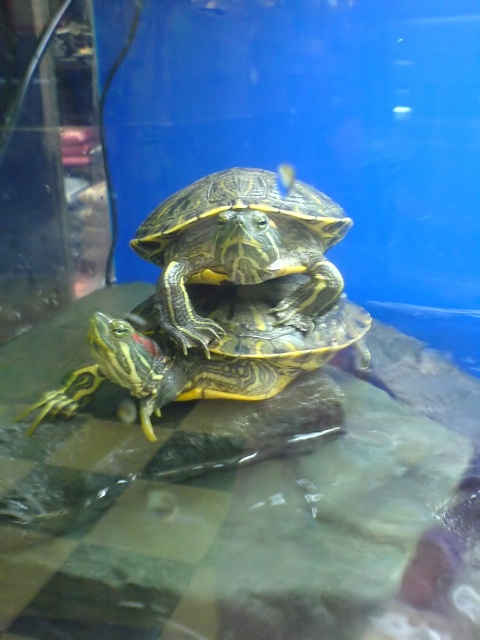
You are a visitor at the aquarium and want to know which object is taller between the shiny green shell at center and the shiny green tortoise at center. Can you tell me?

The shiny green shell at center is much taller than the shiny green tortoise at center.

You are a visitor at an aquarium observing the two shiny green shell at center and shiny green tortoise at center. Which object is positioned higher in the image?

The shiny green shell at center is positioned above the shiny green tortoise at center, so it is higher in the image.